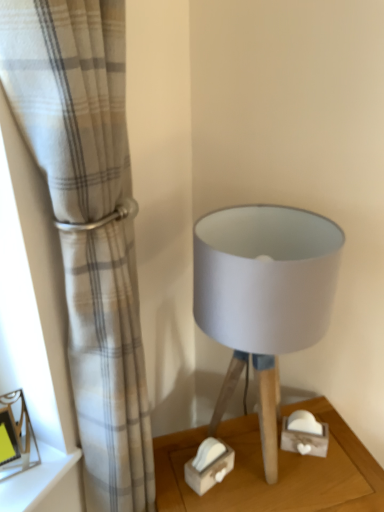
The width and height of the screenshot is (384, 512). In order to click on free location to the right of wooden tissue box at lower center in this screenshot , I will do `click(273, 481)`.